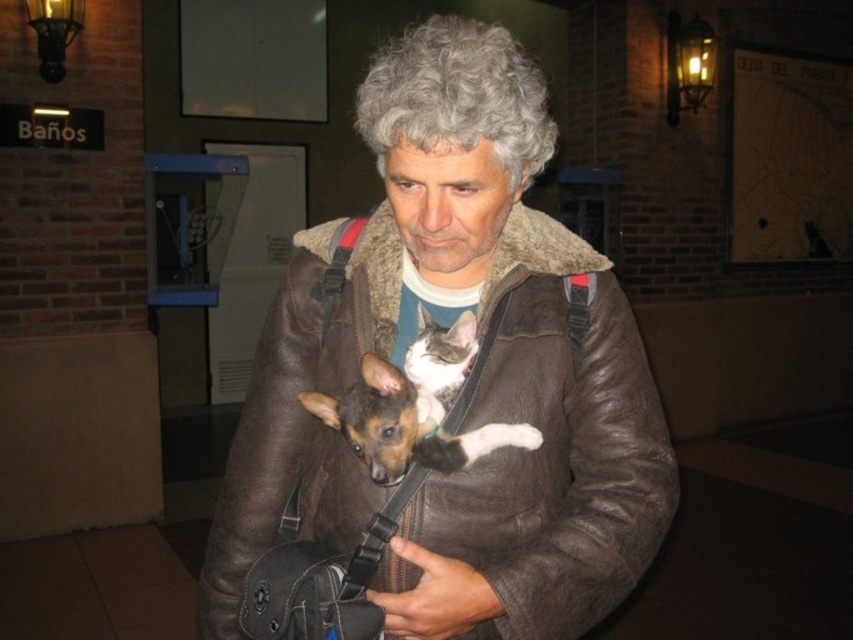
You are a security guard in a museum and notice a suspicious item. You see the brown leather jacket at center and the brown leather dog at center. Which item is closer to you?

The brown leather jacket at center is closer to you because the brown leather dog at center is behind it.

You are standing in a restroom area and see a man wearing a brown leather jacket at center. If you want to hand him a paper towel that is 11 inches long, can you reach him without moving closer?

The distance of brown leather jacket at center from viewer is 31.02 inches. Since the paper towel is 11 inches long, you would need to move closer to reach him as the distance exceeds the paper towel length.